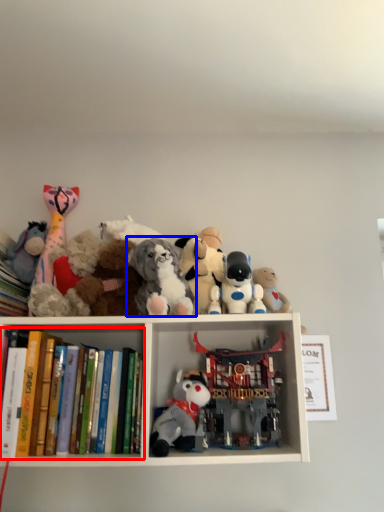
Question: Which point is closer to the camera, book (highlighted by a red box) or toy (highlighted by a blue box)?

Choices:
 (A) book
 (B) toy

Answer: (A)